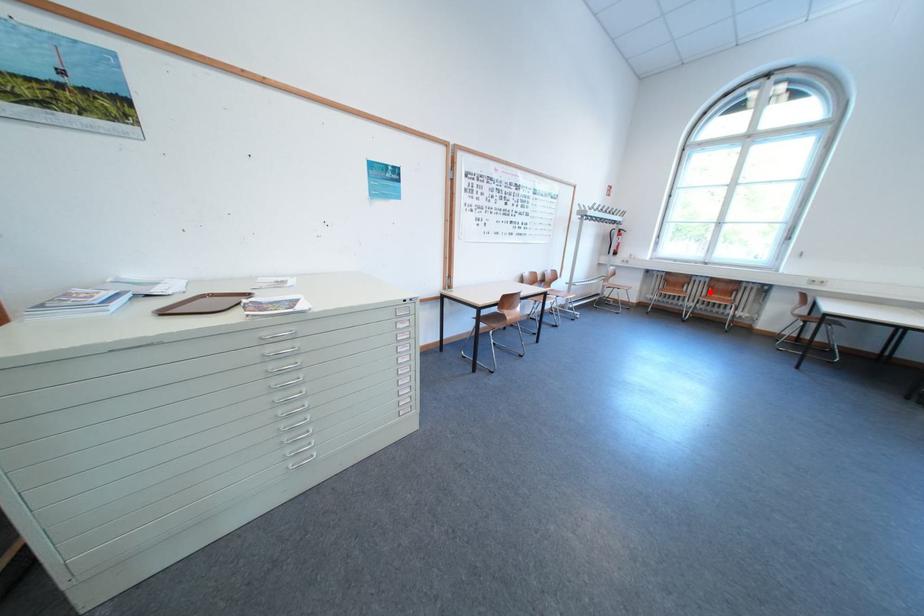
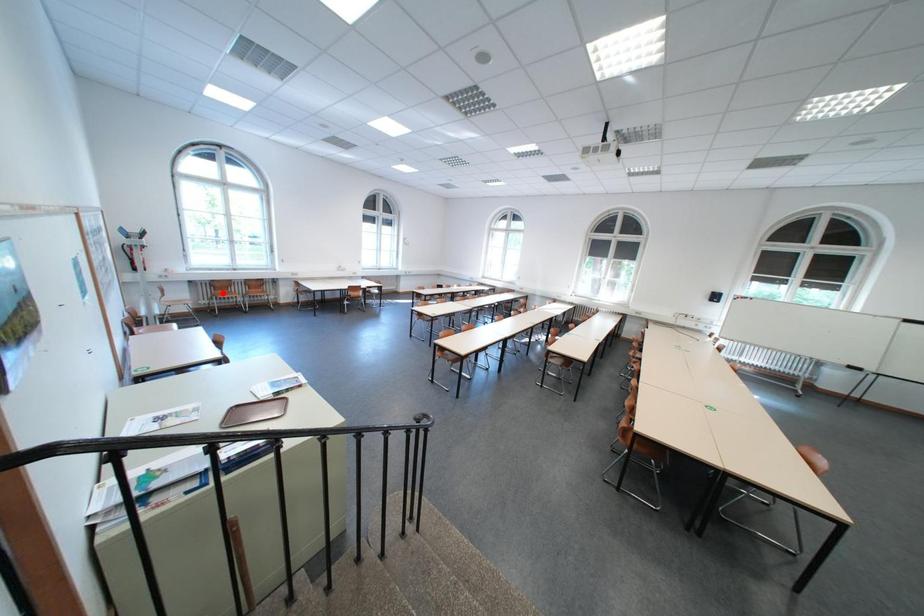
I am providing you with two images of the same scene from different viewpoints. A red point is marked on the first image and another point is marked on the second image. Is the red point in image1 aligned with the point shown in image2?

No